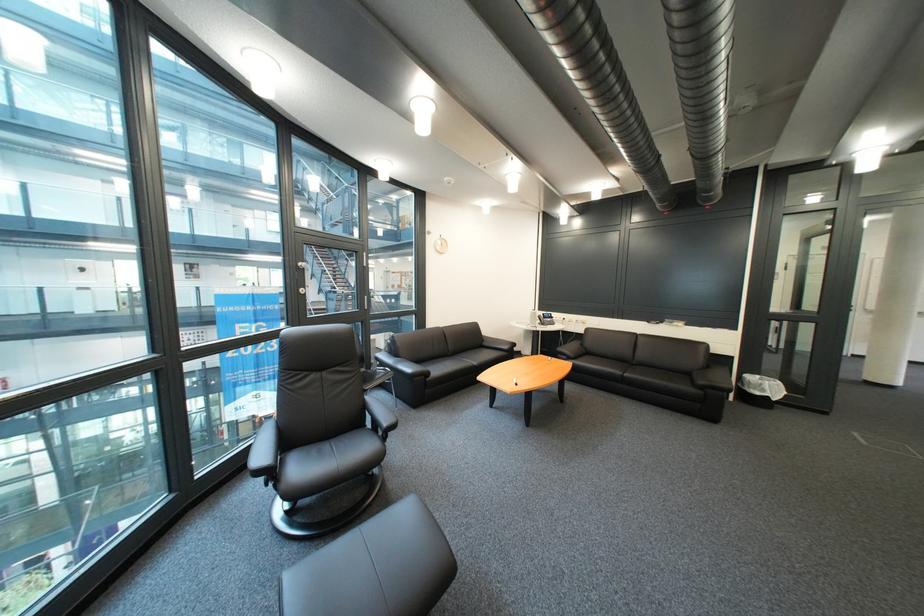
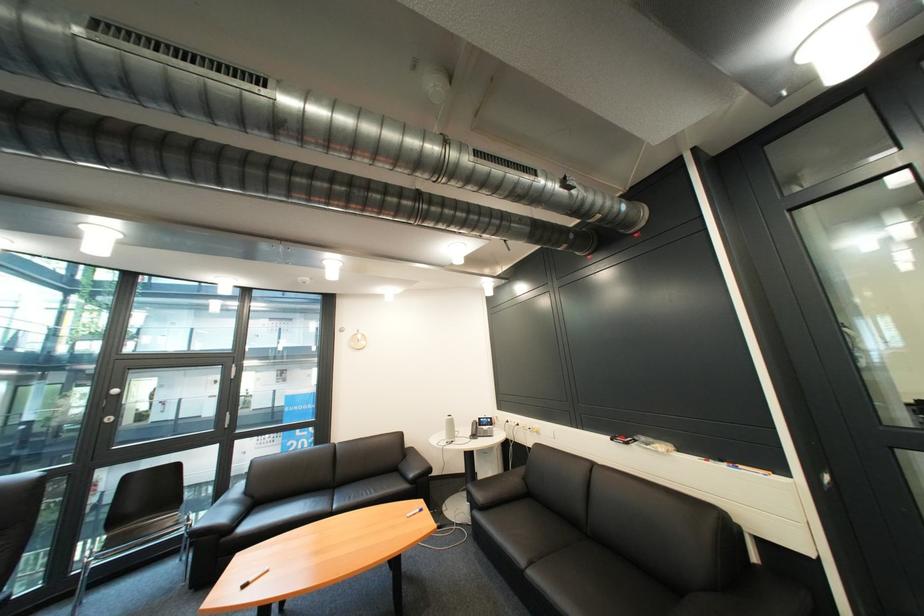
Find the pixel in the second image that matches (x=578, y=321) in the first image.

(531, 426)